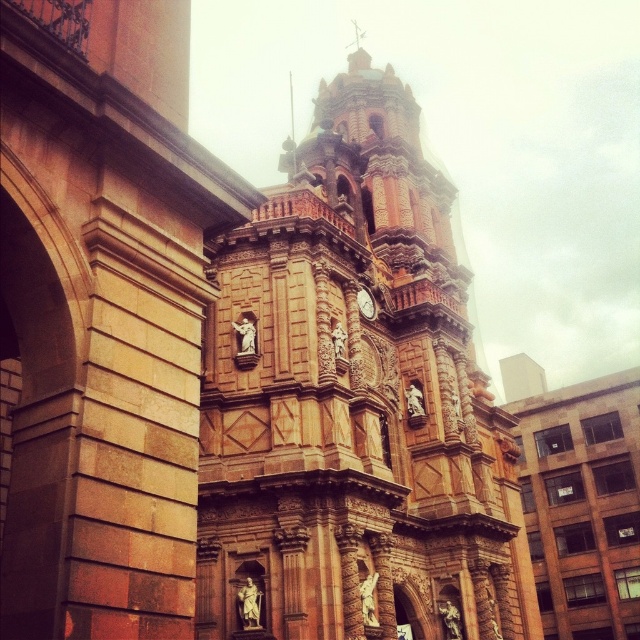
Question: Which point appears farthest from the camera in this image?

Choices:
 (A) (241, 385)
 (B) (372, 301)

Answer: (B)

Question: Does brown stone tower at center have a larger size compared to gold metallic clock at center?

Choices:
 (A) yes
 (B) no

Answer: (A)

Question: Which point is farther to the camera?

Choices:
 (A) (365, 300)
 (B) (390, 332)

Answer: (B)

Question: Can you confirm if brown stone tower at center is smaller than gold metallic clock at center?

Choices:
 (A) no
 (B) yes

Answer: (A)

Question: Among these objects, which one is nearest to the camera?

Choices:
 (A) gold metallic clock at center
 (B) brown stone tower at center

Answer: (B)

Question: Can you confirm if brown stone tower at center is positioned to the left of gold metallic clock at center?

Choices:
 (A) no
 (B) yes

Answer: (A)